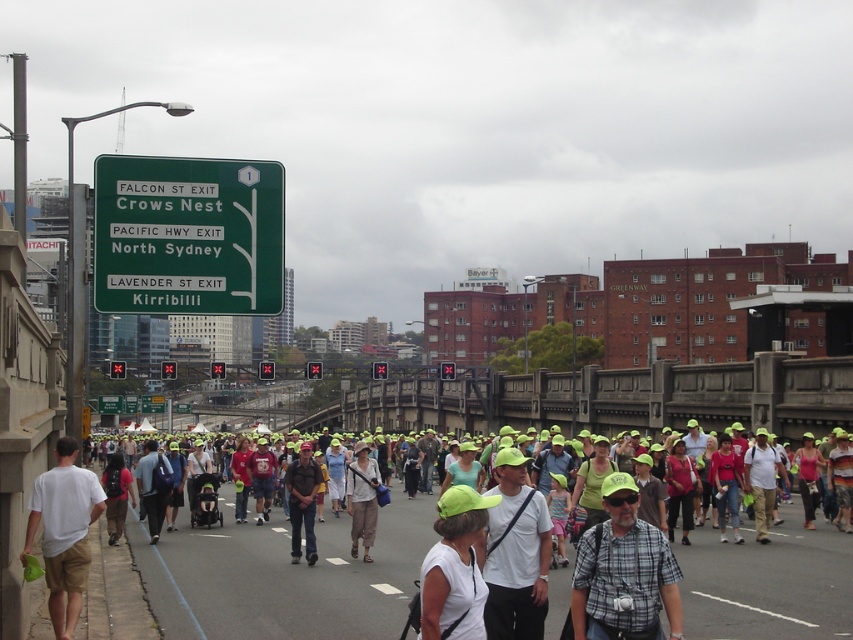
You are a photographer trying to capture a closeup of the plaid shirt at center and the white matte cap at center. Which object should you zoom in on first to ensure it fits entirely within the frame?

The plaid shirt at center is wider than the white matte cap at center, so you should zoom in on the white matte cap at center first to ensure it fits entirely within the frame.

You are standing at the origin point of the image and want to locate the plaid shirt at center. In which direction should you look to find it?

The plaid shirt at center is located at point 0.895 in the x direction and 0.732 in the y direction, so you should look to the upper right direction from the origin point.